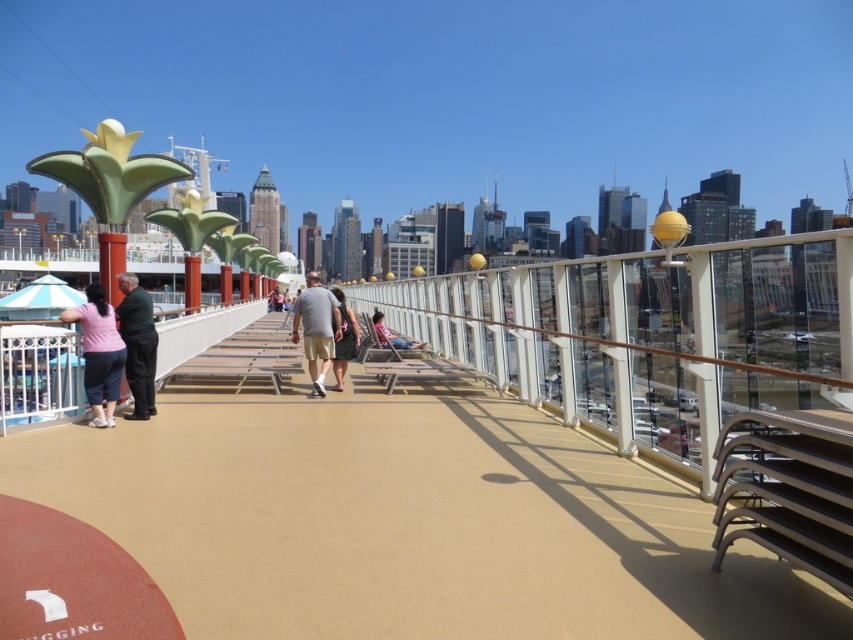
Question: Is matte gray shorts at center to the left of pink fabric chair at center from the viewer's perspective?

Choices:
 (A) no
 (B) yes

Answer: (B)

Question: Which object is positioned closest to the gray fabric shirt at center?

Choices:
 (A) matte gray shorts at center
 (B) matte pink shirt at left
 (C) beige rubber deck at center
 (D) pink fabric chair at center

Answer: (A)

Question: Can you confirm if gray fabric shirt at center is thinner than pink fabric chair at center?

Choices:
 (A) yes
 (B) no

Answer: (B)

Question: Based on their relative distances, which object is nearer to the matte pink shirt at left?

Choices:
 (A) dark green fabric jacket at left
 (B) beige rubber deck at center

Answer: (A)

Question: Which object is positioned closest to the pink fabric chair at center?

Choices:
 (A) dark green fabric jacket at left
 (B) beige rubber deck at center

Answer: (A)

Question: Is beige rubber deck at center thinner than matte gray shorts at center?

Choices:
 (A) no
 (B) yes

Answer: (A)